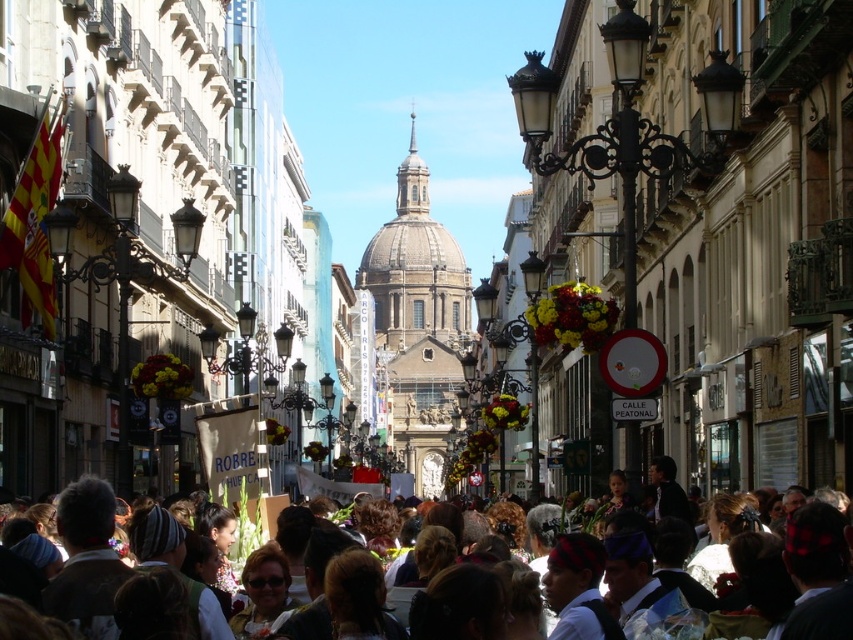
Question: Which of the following is the farthest from the observer?

Choices:
 (A) (7, 616)
 (B) (445, 336)

Answer: (B)

Question: Can you confirm if smooth stone dome at center is smaller than brown hair at center?

Choices:
 (A) no
 (B) yes

Answer: (A)

Question: Does smooth stone dome at center have a greater width compared to brown hair at center?

Choices:
 (A) no
 (B) yes

Answer: (B)

Question: Does smooth stone dome at center come behind brown hair at center?

Choices:
 (A) no
 (B) yes

Answer: (B)

Question: Among these points, which one is farthest from the camera?

Choices:
 (A) (380, 593)
 (B) (421, 420)

Answer: (B)